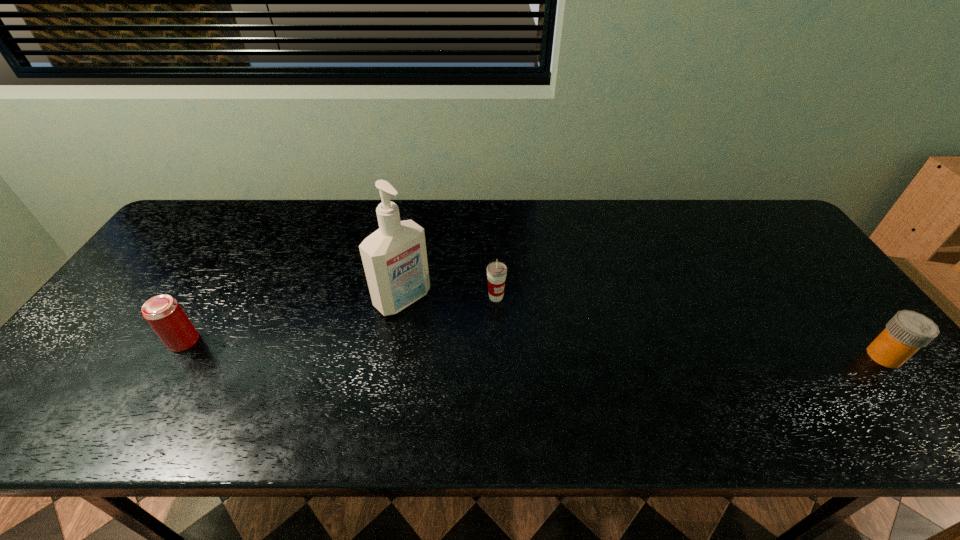
Where is `free spot on the desktop that is between the beer can and the rightmost object and is positioned on the side of the cup with the logo`? free spot on the desktop that is between the beer can and the rightmost object and is positioned on the side of the cup with the logo is located at coordinates (551, 349).

Locate an element on the screen. free space on the desktop that is between the leftmost object and the medicine and is positioned on the front label of the cleansing agent is located at coordinates (456, 347).